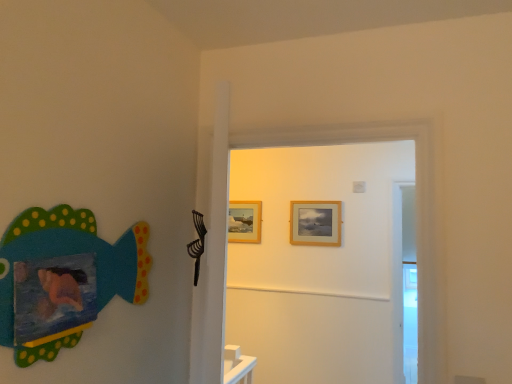
Locate an element on the screen. The height and width of the screenshot is (384, 512). free space above wooden door at center (from a real-world perspective) is located at coordinates (318, 110).